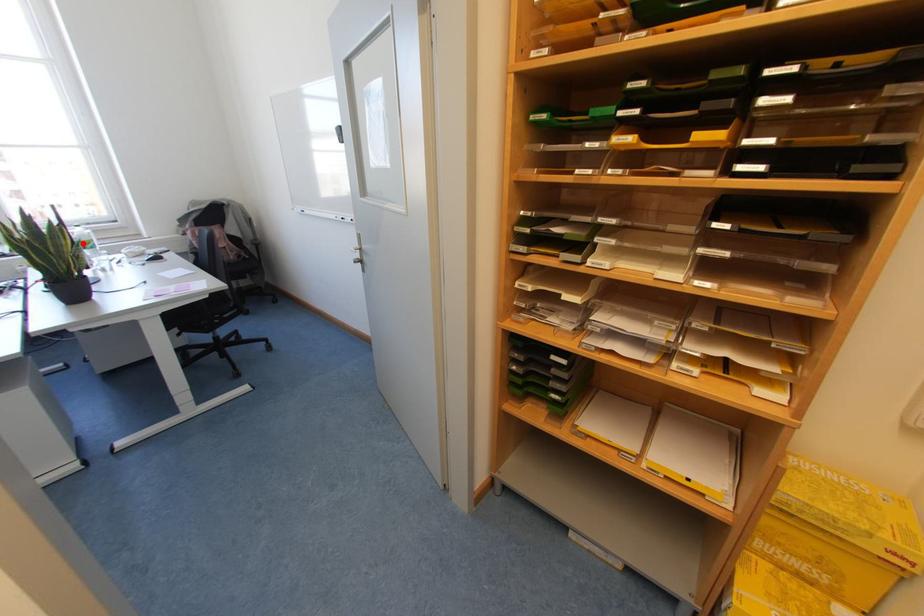
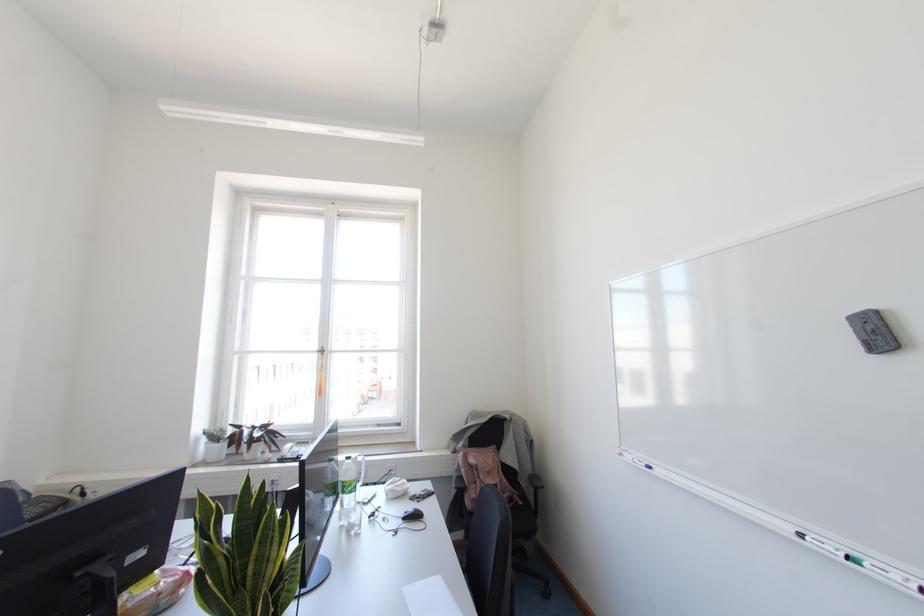
Question: I am providing you with two images of the same scene from different viewpoints. In image1, a red point is highlighted. Considering the same 3D point in image2, which of the following is correct?

Choices:
 (A) It is closer
 (B) It is farther

Answer: (A)